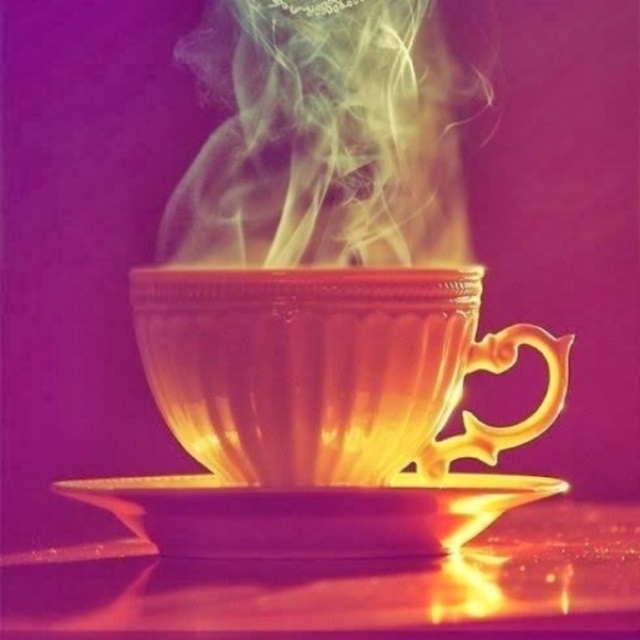
Question: Which object is closer to the camera taking this photo?

Choices:
 (A) gold metallic saucer at center
 (B) translucent amber cup at center
 (C) glossy reflective table at center

Answer: (C)

Question: Can you confirm if translucent amber cup at center is wider than glossy reflective table at center?

Choices:
 (A) no
 (B) yes

Answer: (A)

Question: Does translucent amber cup at center appear over gold metallic saucer at center?

Choices:
 (A) no
 (B) yes

Answer: (B)

Question: Which object is positioned farthest from the gold metallic saucer at center?

Choices:
 (A) glossy reflective table at center
 (B) translucent amber cup at center

Answer: (A)

Question: Is glossy reflective table at center to the left of gold metallic saucer at center from the viewer's perspective?

Choices:
 (A) yes
 (B) no

Answer: (B)

Question: Which point is closer to the camera taking this photo?

Choices:
 (A) (202, 275)
 (B) (456, 506)

Answer: (A)